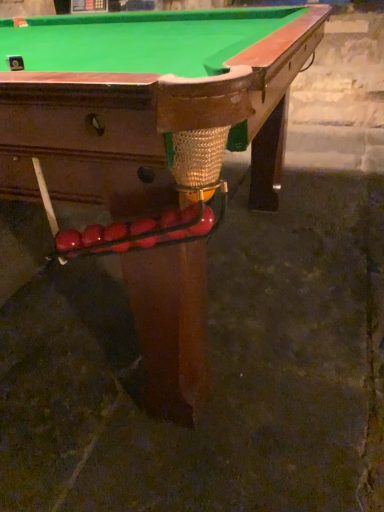
Question: From a real-world perspective, relative to shiny brown wood billiard table at center, is glossy red balls at lower left vertically above or below?

Choices:
 (A) above
 (B) below

Answer: (A)

Question: Which is correct: glossy red balls at lower left is inside shiny brown wood billiard table at center, or outside of it?

Choices:
 (A) outside
 (B) inside

Answer: (B)

Question: In the image, is glossy red balls at lower left positioned in front of or behind shiny brown wood billiard table at center?

Choices:
 (A) front
 (B) behind

Answer: (B)

Question: Is shiny brown wood billiard table at center inside or outside of glossy red balls at lower left?

Choices:
 (A) inside
 (B) outside

Answer: (B)

Question: Looking at the image, does shiny brown wood billiard table at center seem bigger or smaller compared to glossy red balls at lower left?

Choices:
 (A) big
 (B) small

Answer: (A)

Question: In terms of width, does shiny brown wood billiard table at center look wider or thinner when compared to glossy red balls at lower left?

Choices:
 (A) thin
 (B) wide

Answer: (B)

Question: Is shiny brown wood billiard table at center in front of or behind glossy red balls at lower left in the image?

Choices:
 (A) front
 (B) behind

Answer: (A)